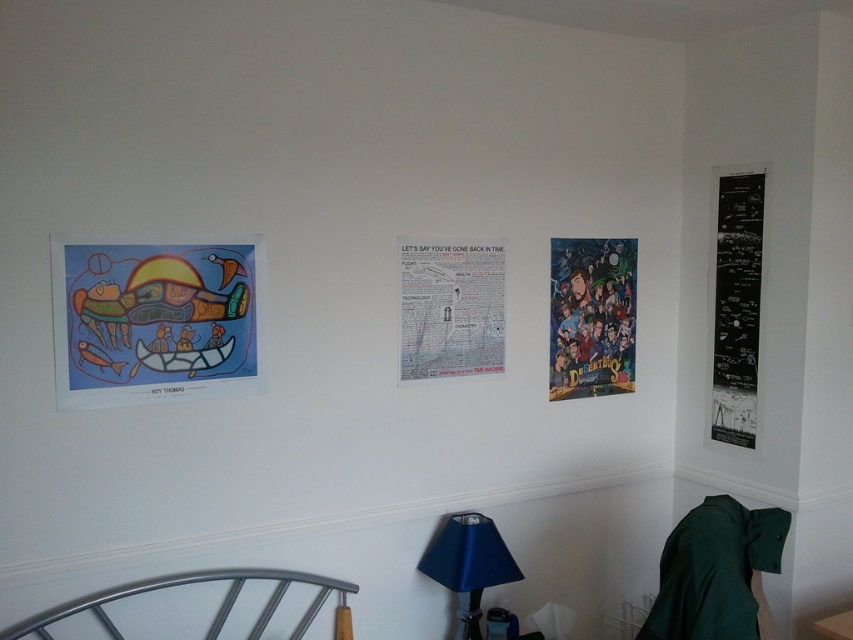
You are standing in the room and want to hang a new picture frame that is 0.5 meters wide between the matte paper poster at upper left and the blue fabric lampshade at lower center. Is there enough space between them to fit the frame without overlapping?

The distance between the matte paper poster at upper left and the blue fabric lampshade at lower center is 1.03 meters. Since the picture frame is 0.5 meters wide, there is sufficient space to place it between them without overlapping.

From the picture: You are standing in the room and want to touch the colorful paper poster at center right and the silver metallic bed at lower left. Which object will you need to reach out further to touch?

The silver metallic bed at lower left is further away from you than the colorful paper poster at center right, so you will need to reach out further to touch the silver metallic bed at lower left.

You are standing in the room and want to hang a new poster between the white paper poster at center and the colorful paper poster at center right. Is there enough space between them to place your new poster?

The white paper poster at center is to the left of the colorful paper poster at center right, so there is space between them to place the new poster.